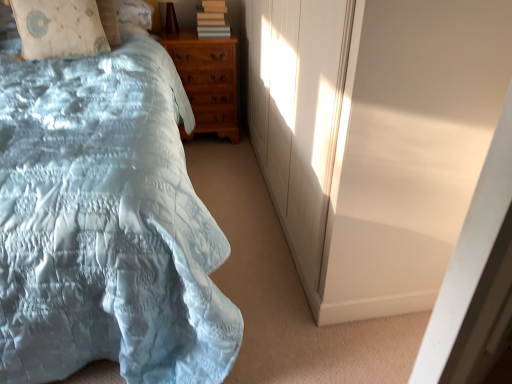
Question: From the image's perspective, is white matte screen door at upper right positioned above or below beige fabric pillow at upper left?

Choices:
 (A) above
 (B) below

Answer: (B)

Question: In the image, is white matte screen door at upper right on the left side or the right side of beige fabric pillow at upper left?

Choices:
 (A) right
 (B) left

Answer: (A)

Question: Considering the real-world distances, which object is farthest from the light brown wooden chest of drawers at center?

Choices:
 (A) white matte screen door at upper right
 (B) matte gray book at upper center
 (C) beige fabric pillow at upper left
 (D) matte brown table lamp at upper center
 (E) light blue satin bed at left

Answer: (A)

Question: Which of these objects is positioned closest to the white matte screen door at upper right?

Choices:
 (A) beige fabric pillow at upper left
 (B) matte brown table lamp at upper center
 (C) light brown wooden chest of drawers at center
 (D) matte gray book at upper center
 (E) light blue satin bed at left

Answer: (E)